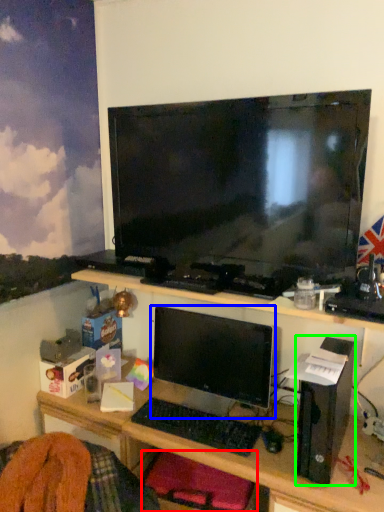
Question: Which is nearer to the computer chair (highlighted by a red box)? computer monitor (highlighted by a blue box) or computer (highlighted by a green box).

Choices:
 (A) computer monitor
 (B) computer

Answer: (A)